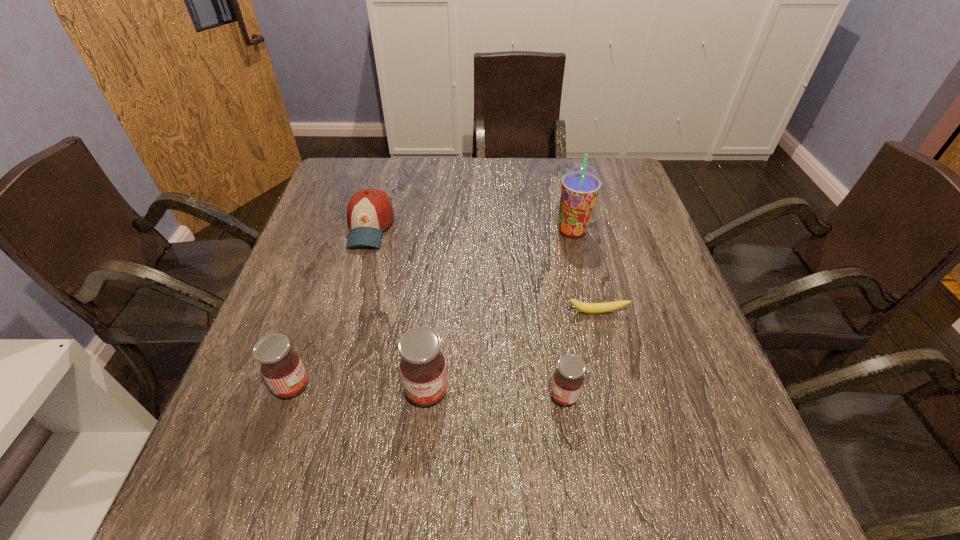
Select which object appears as the fourth closest to the baseball cap. Please provide its 2D coordinates. Your answer should be formatted as a tuple, i.e. [(x, y)], where the tuple contains the x and y coordinates of a point satisfying the conditions above.

[(591, 308)]

The width and height of the screenshot is (960, 540). I want to click on jam that is the closest one to the tallest jam, so click(x=280, y=365).

Where is `jam that stands as the closest to the baseball cap`? Image resolution: width=960 pixels, height=540 pixels. jam that stands as the closest to the baseball cap is located at coordinates (280, 365).

Image resolution: width=960 pixels, height=540 pixels. Find the location of `free spot that satisfies the following two spatial constraints: 1. on the upward curve of the third farthest object; 2. on the label side of the second tallest jam`. free spot that satisfies the following two spatial constraints: 1. on the upward curve of the third farthest object; 2. on the label side of the second tallest jam is located at coordinates (614, 386).